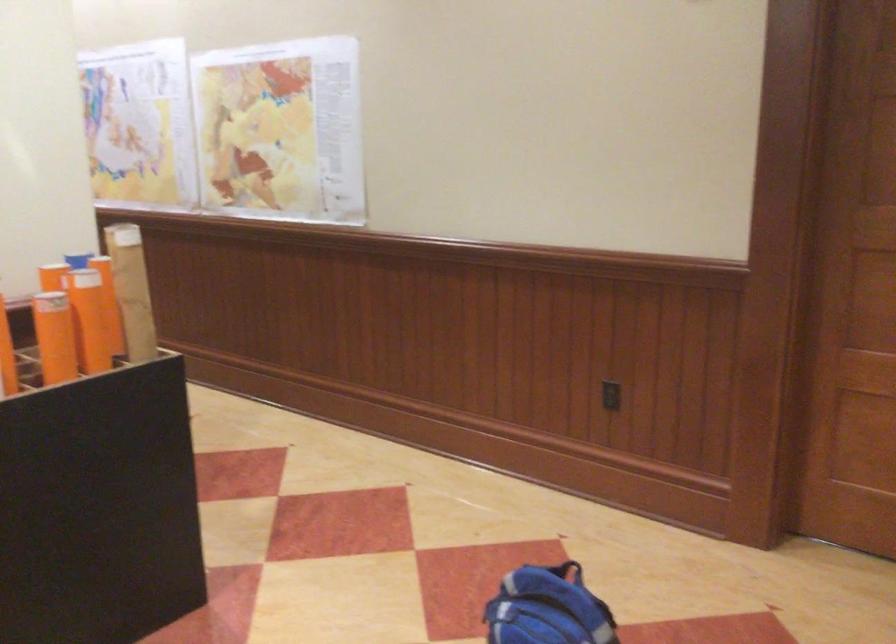
Where would you lift the brown cardboard tube? Please return your answer as a coordinate pair (x, y).

(132, 290)